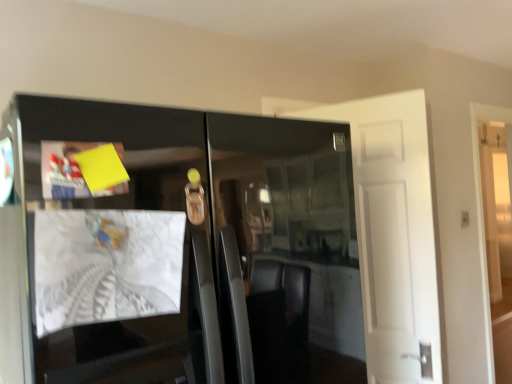
Question: Considering the positions of white matte door at right, which is the 2th door from left to right, and yellow paper at upper left, the first magazine from the top, in the image, is white matte door at right, which is the 2th door from left to right, bigger or smaller than yellow paper at upper left, the first magazine from the top,?

Choices:
 (A) small
 (B) big

Answer: (B)

Question: Is white matte door at right, which is counted as the first door, starting from the back, to the left or to the right of yellow paper at upper left, the 2th magazine positioned from the bottom, in the image?

Choices:
 (A) left
 (B) right

Answer: (B)

Question: Estimate the real-world distances between objects in this image. Which object is closer to the white matte door at right, which is the 2th door in front-to-back order?

Choices:
 (A) yellow paper at upper left, the 2th magazine positioned from the bottom
 (B) white matte door at upper right, the 1th door viewed from the left
 (C) glossy black cabinet at center
 (D) white paper at left, arranged as the 1th magazine when ordered from the bottom

Answer: (B)

Question: Which is farther from the white matte door at right, which ranks as the 1th door in right-to-left order?

Choices:
 (A) white paper at left, arranged as the 1th magazine when ordered from the bottom
 (B) glossy black cabinet at center
 (C) yellow paper at upper left, the first magazine from the top
 (D) white matte door at upper right, which appears as the 2th door when viewed from the right

Answer: (C)